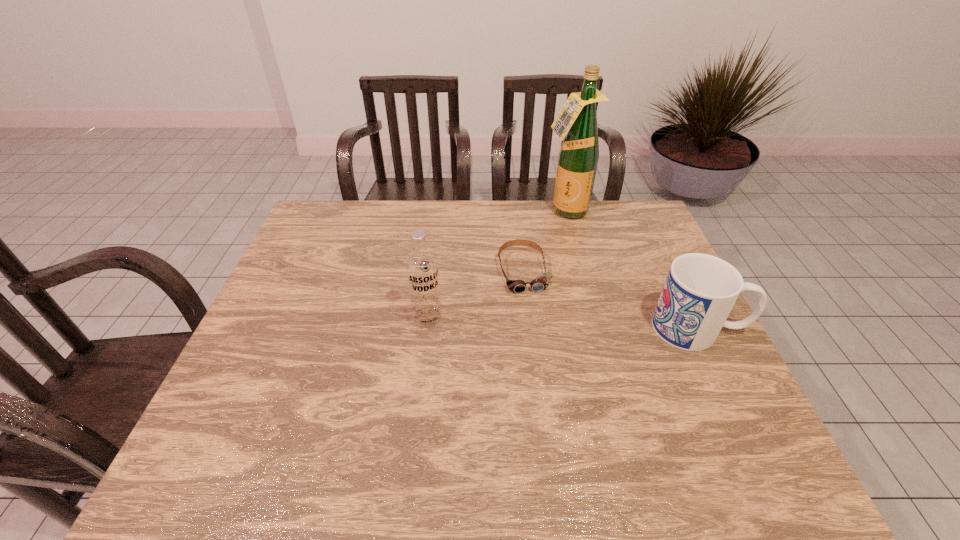
You are a GUI agent. You are given a task and a screenshot of the screen. Output one action in this format:
    pyautogui.click(x=<x>, y=<y>)
    Task: Click on the vacant space situated 0.280m on the front-facing side of the shortest object
    This screenshot has width=960, height=540.
    Given the screenshot: What is the action you would take?
    pyautogui.click(x=552, y=377)

Where is `free region located on the front-facing side of the shortest object`? This screenshot has width=960, height=540. free region located on the front-facing side of the shortest object is located at coordinates (555, 388).

At what (x,y) coordinates should I click in order to perform the action: click on vacant space located on the front-facing side of the shortest object. Please return your answer as a coordinate pair (x, y). Looking at the image, I should click on (546, 357).

Identify the location of vacant area situated on the front-facing side of the liquor. (571, 283).

Where is `free space located 0.400m on the front-facing side of the liquor`? free space located 0.400m on the front-facing side of the liquor is located at coordinates (572, 305).

Locate an element on the screen. free space located on the front-facing side of the liquor is located at coordinates (570, 272).

Locate an element on the screen. Image resolution: width=960 pixels, height=540 pixels. object positioned at the far edge is located at coordinates (577, 121).

Find the location of a particular element. This screenshot has width=960, height=540. object that is positioned at the right edge is located at coordinates (700, 291).

The image size is (960, 540). Find the location of `blank area at the far edge`. blank area at the far edge is located at coordinates (381, 208).

Image resolution: width=960 pixels, height=540 pixels. In order to click on blank space at the near edge of the desktop in this screenshot , I will do `click(671, 416)`.